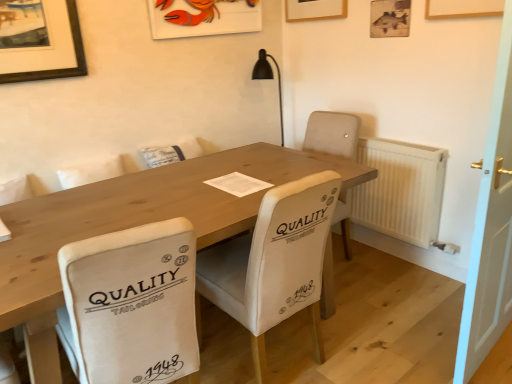
Question: Is point tap(202, 14) positioned closer to the camera than point tap(287, 213)?

Choices:
 (A) farther
 (B) closer

Answer: (A)

Question: From a real-world perspective, is matte plastic picture frame at upper center, the 1th picture frame from the left, above or below white fabric chair at center, the first chair positioned from the right?

Choices:
 (A) below
 (B) above

Answer: (B)

Question: Estimate the real-world distances between objects in this image. Which object is closer to the wooden picture frame at upper right, which is the 1th picture frame from right to left?

Choices:
 (A) white fabric chair at center, arranged as the second chair when viewed from the left
 (B) white plastic radiator at right
 (C) natural wood table at center
 (D) white wooden door at right
 (E) white fabric chair at center, which ranks as the 2th chair in right-to-left order

Answer: (B)

Question: Considering the real-world distances, which object is farthest from the white plastic radiator at right?

Choices:
 (A) natural wood table at center
 (B) white wooden door at right
 (C) white fabric chair at center, which is counted as the first chair, starting from the left
 (D) matte plastic picture frame at upper center, the 1th picture frame from the left
 (E) wooden picture frame at upper right, which is the 1th picture frame from right to left

Answer: (C)